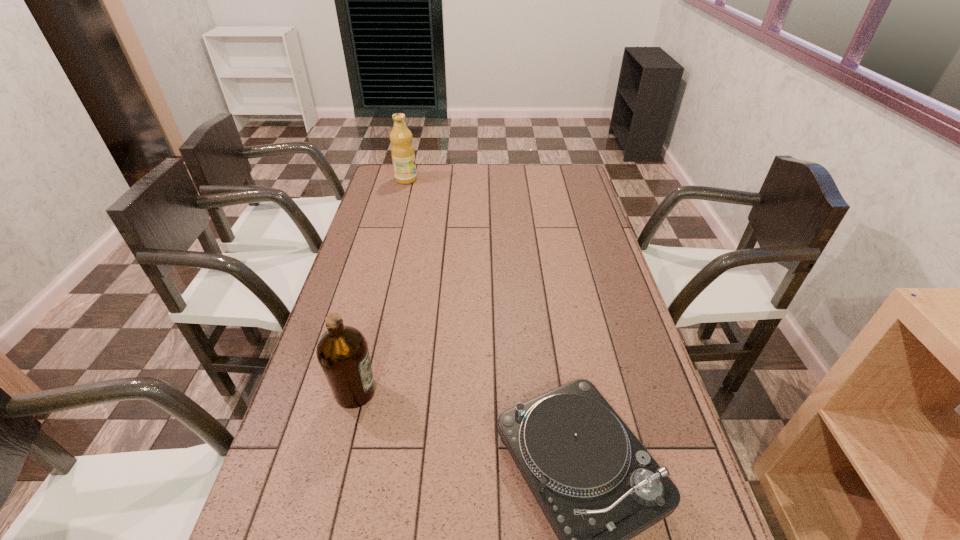
Find the location of a particular element. Image resolution: width=960 pixels, height=540 pixels. the farthest object is located at coordinates (403, 156).

Image resolution: width=960 pixels, height=540 pixels. What are the coordinates of `the nearer olive oil` in the screenshot? It's located at (342, 351).

The height and width of the screenshot is (540, 960). What are the coordinates of `vacant region located 0.220m on the label of the farther olive oil` in the screenshot? It's located at (467, 179).

Where is `vacant area situated on the label of the nearer olive oil`? vacant area situated on the label of the nearer olive oil is located at coordinates (472, 392).

Identify the location of object that is positioned at the far edge. (403, 156).

Identify the location of object that is at the far left corner. This screenshot has height=540, width=960. (403, 156).

In the image, there is a desktop. Where is `vacant space at the far edge`? This screenshot has height=540, width=960. vacant space at the far edge is located at coordinates (445, 177).

In the image, there is a desktop. Where is `blank space at the left edge`? The height and width of the screenshot is (540, 960). blank space at the left edge is located at coordinates (370, 208).

Locate an element on the screen. The height and width of the screenshot is (540, 960). vacant space at the right edge of the desktop is located at coordinates tap(597, 217).

This screenshot has height=540, width=960. What are the coordinates of `free space at the far left corner of the desktop` in the screenshot? It's located at (387, 189).